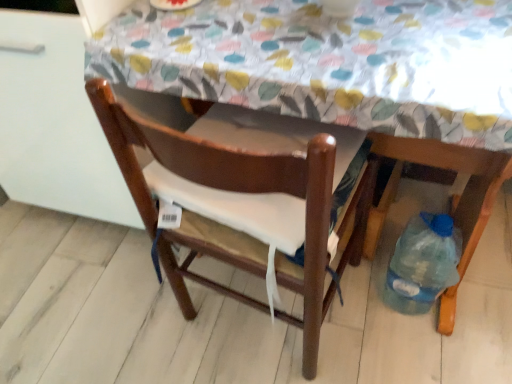
I want to click on spots to the right of translucent plastic bottle at lower right, which ranks as the first chair in right-to-left order, so click(x=480, y=303).